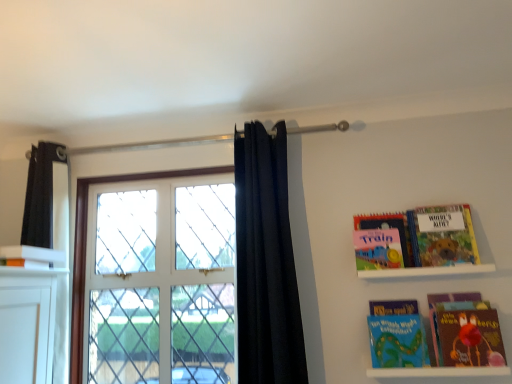
I want to click on free space below hardcover book at upper right, which is the 1th book from right to left (from a real-world perspective), so click(444, 262).